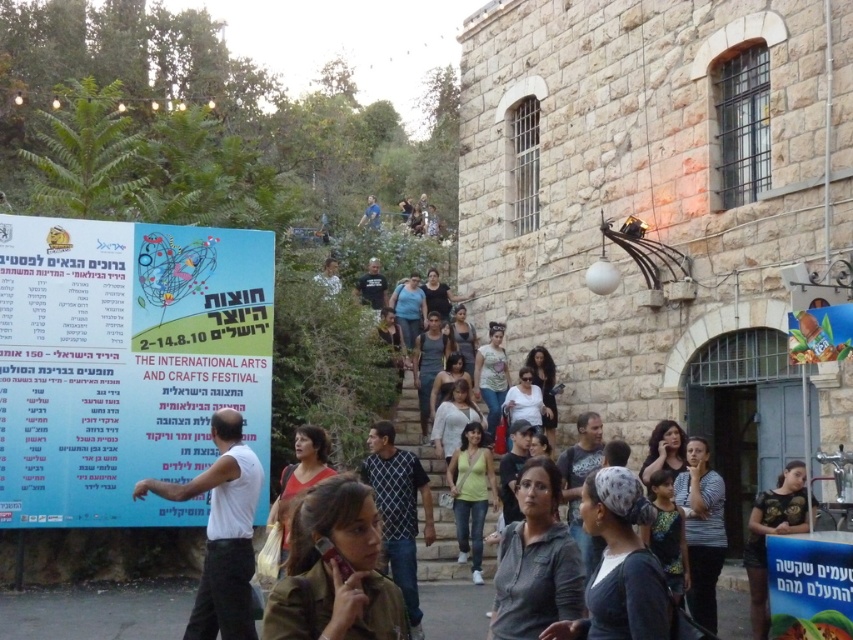
Question: Where is white paper poster at left located in relation to black cotton t-shirt at center in the image?

Choices:
 (A) below
 (B) above

Answer: (A)

Question: Is light yellow cotton tank top at center further to the viewer compared to matte red shirt at center?

Choices:
 (A) yes
 (B) no

Answer: (A)

Question: Which point is farther from the camera taking this photo?

Choices:
 (A) (357, 289)
 (B) (479, 465)

Answer: (A)

Question: Which point appears closest to the camera in this image?

Choices:
 (A) (329, 468)
 (B) (376, 276)

Answer: (A)

Question: Estimate the real-world distances between objects in this image. Which object is closer to the light brown leather jacket at upper center?

Choices:
 (A) white cotton t-shirt at center
 (B) white paper poster at left
 (C) striped shirt at lower right
 (D) blue paper poster at lower right

Answer: (B)

Question: Can you confirm if light yellow cotton tank top at center is positioned to the left of black cotton t-shirt at center?

Choices:
 (A) yes
 (B) no

Answer: (B)